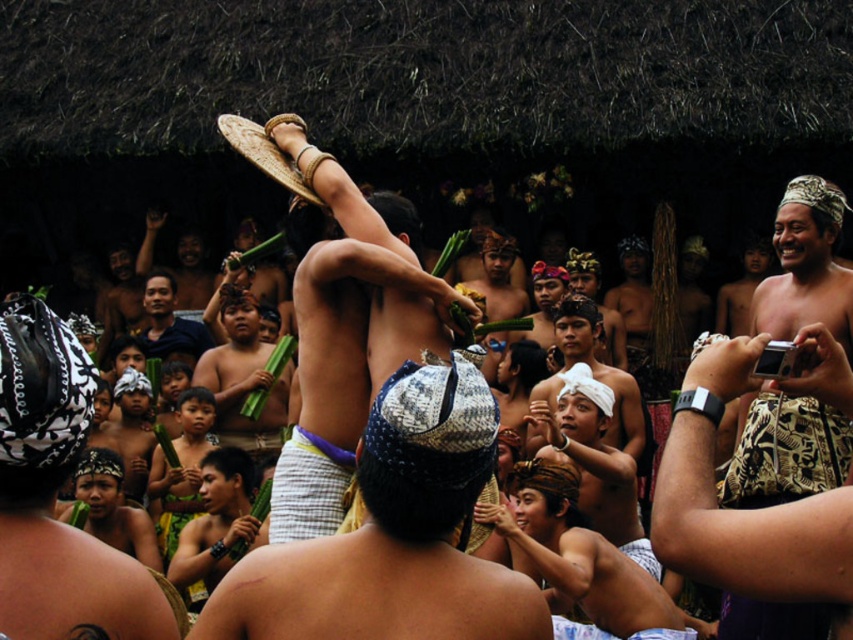
Based on the photo, can you confirm if white woven cloth at lower center is positioned to the right of matte woven mat at center?

Yes, white woven cloth at lower center is to the right of matte woven mat at center.

Is white woven cloth at lower center shorter than matte woven mat at center?

Yes, white woven cloth at lower center is shorter than matte woven mat at center.

Where is `white woven cloth at lower center`? white woven cloth at lower center is located at coordinates (579, 561).

Between point (503, 515) and point (199, 346), which one is positioned behind?

The point (199, 346) is more distant.

Who is lower down, white woven cloth at lower center or matte black shirt at center?

white woven cloth at lower center is lower down.

Who is more distant from viewer, (x=543, y=561) or (x=149, y=294)?

Positioned behind is point (x=149, y=294).

What are the coordinates of `white woven cloth at lower center` in the screenshot? It's located at (579, 561).

Describe the element at coordinates (746, 508) in the screenshot. Image resolution: width=853 pixels, height=640 pixels. I see `printed fabric camera at right` at that location.

Is point (833, 388) farther from camera compared to point (532, 477)?

No.

I want to click on printed fabric camera at right, so click(746, 508).